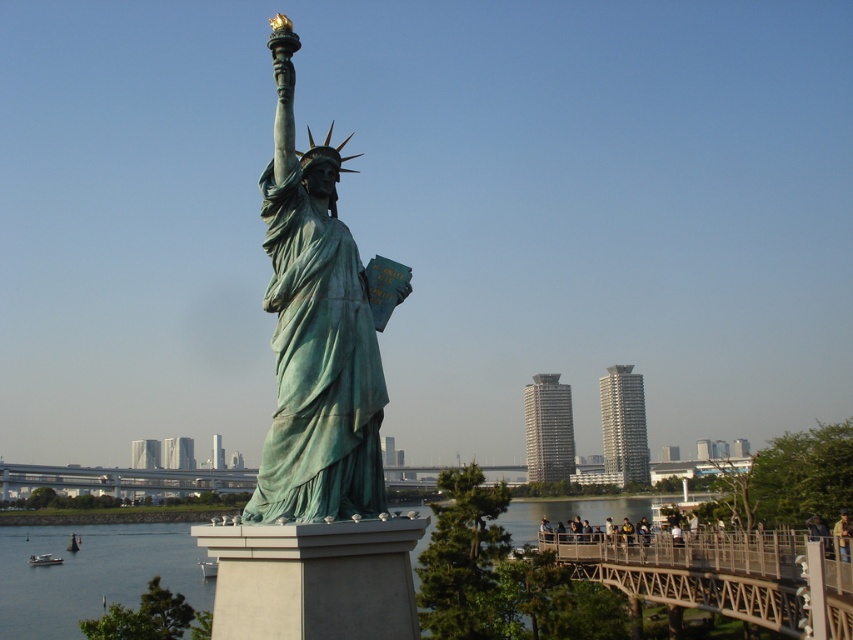
Does green patina statue at center have a larger size compared to metallic gray bridge at lower right?

Actually, green patina statue at center might be smaller than metallic gray bridge at lower right.

Locate an element on the screen. This screenshot has width=853, height=640. green patina statue at center is located at coordinates (x=315, y=333).

This screenshot has width=853, height=640. I want to click on green patina statue at center, so click(x=315, y=333).

Which is more to the left, metallic gray bridge at lower right or metallic gray bridge at center?

metallic gray bridge at center is more to the left.

Between metallic gray bridge at lower right and metallic gray bridge at center, which one has more height?

metallic gray bridge at center is taller.

Does point (749, 605) come closer to viewer compared to point (421, 465)?

Yes, point (749, 605) is closer to viewer.

Where is `metallic gray bridge at lower right`? metallic gray bridge at lower right is located at coordinates (717, 573).

Is green patina statue at center positioned in front of metallic gray bridge at center?

Yes, it is.

Does green patina statue at center appear on the right side of metallic gray bridge at center?

Indeed, green patina statue at center is positioned on the right side of metallic gray bridge at center.

Image resolution: width=853 pixels, height=640 pixels. I want to click on green patina statue at center, so click(x=315, y=333).